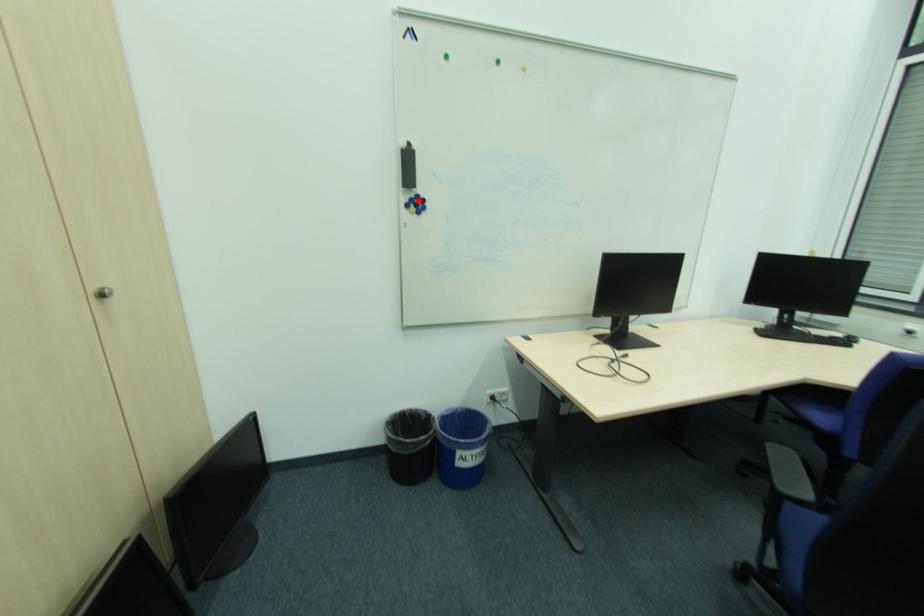
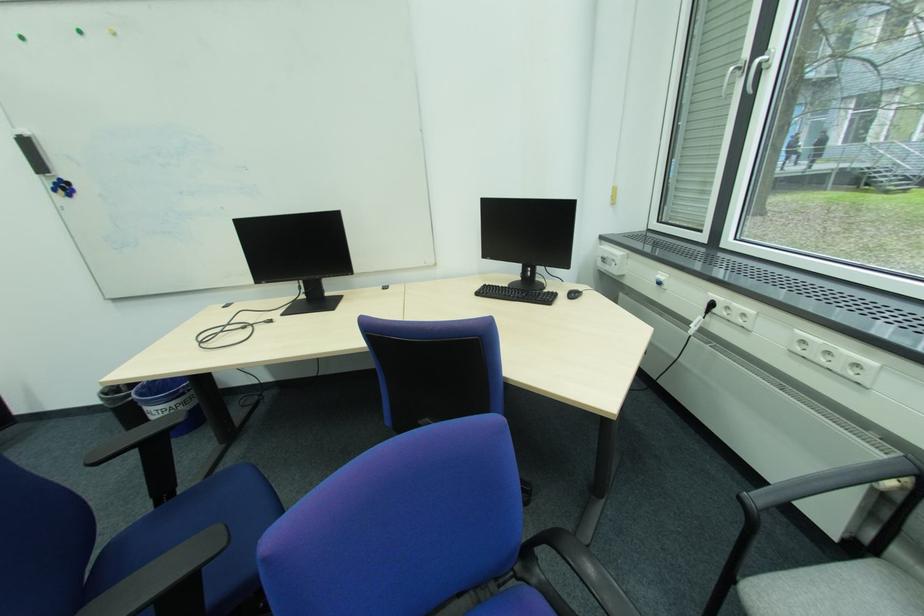
Find the pixel in the second image that matches the highlighted location in the first image.

(62, 185)